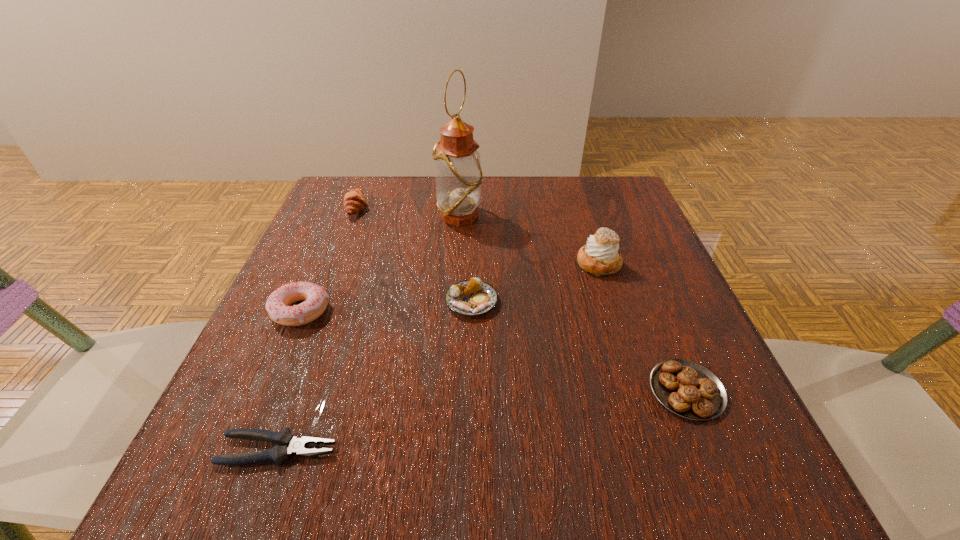
Where is `free space that satisfies the following two spatial constraints: 1. on the front side of the oil lamp; 2. at the gripping part of the nearest object`? This screenshot has width=960, height=540. free space that satisfies the following two spatial constraints: 1. on the front side of the oil lamp; 2. at the gripping part of the nearest object is located at coordinates (445, 450).

Find the location of a particular element. The image size is (960, 540). free space that satisfies the following two spatial constraints: 1. on the front-facing side of the farthest pastry; 2. on the left side of the third farthest object is located at coordinates (335, 264).